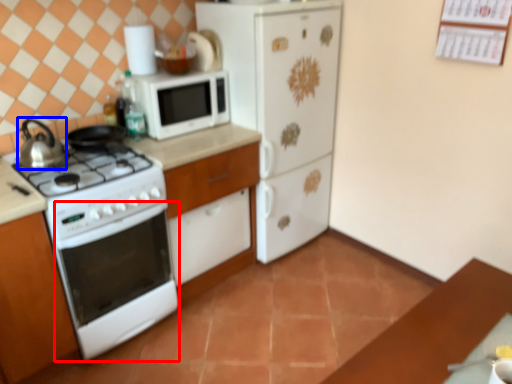
Question: Which object is further to the camera taking this photo, oven (highlighted by a red box) or kitchen appliance (highlighted by a blue box)?

Choices:
 (A) oven
 (B) kitchen appliance

Answer: (B)